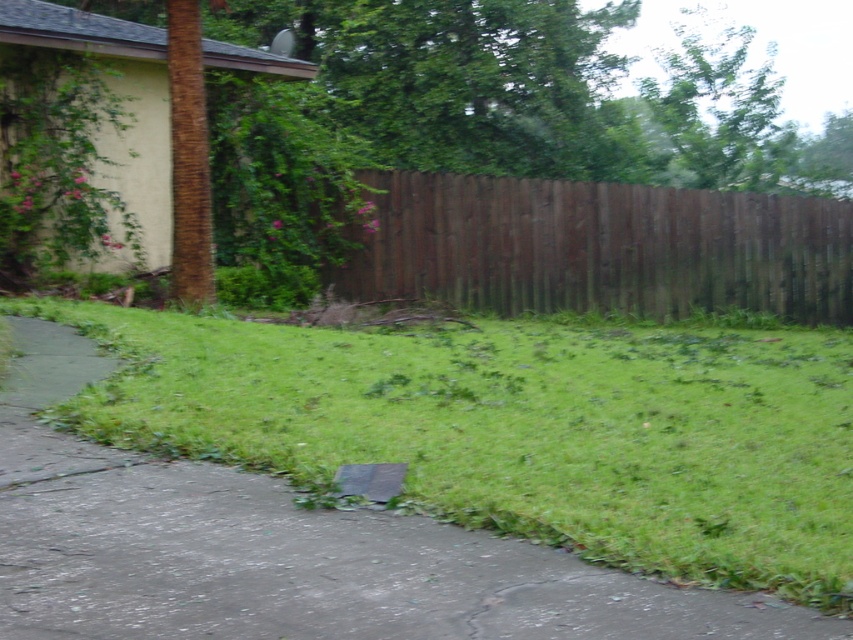
Who is positioned more to the right, green grass at lower left or brown wood fence at center?

Positioned to the right is brown wood fence at center.

At what (x,y) coordinates should I click in order to perform the action: click on green grass at lower left. Please return your answer as a coordinate pair (x, y). Looking at the image, I should click on (518, 429).

At what (x,y) coordinates should I click in order to perform the action: click on green grass at lower left. Please return your answer as a coordinate pair (x, y). The height and width of the screenshot is (640, 853). Looking at the image, I should click on (518, 429).